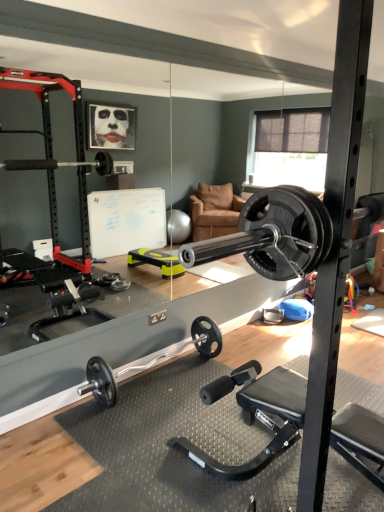
Identify the location of free area below black rubber dumbbell at center (from a real-world perspective). This screenshot has height=512, width=384. (159, 378).